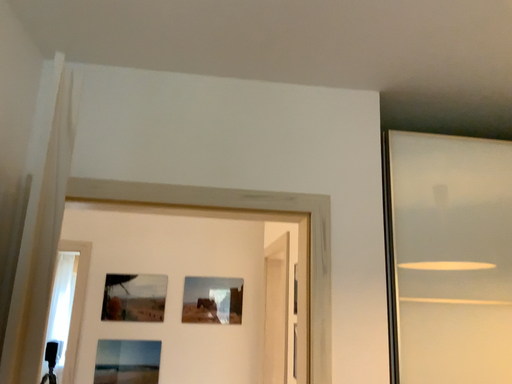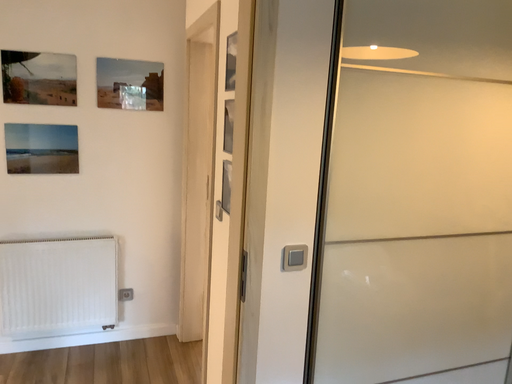
Question: Which way did the camera rotate in the video?

Choices:
 (A) rotated right
 (B) rotated left

Answer: (A)